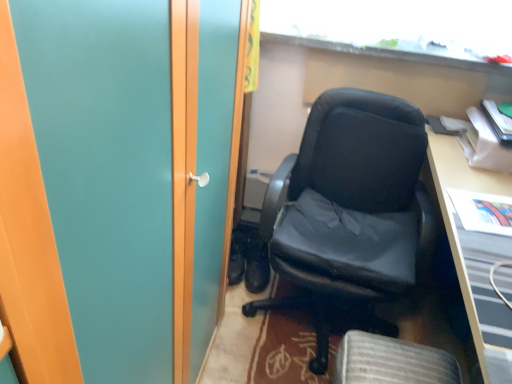
Locate an element on the screen. The image size is (512, 384). free space in front of black leather shoes at center, which ranks as the second footwear in left-to-right order is located at coordinates (262, 306).